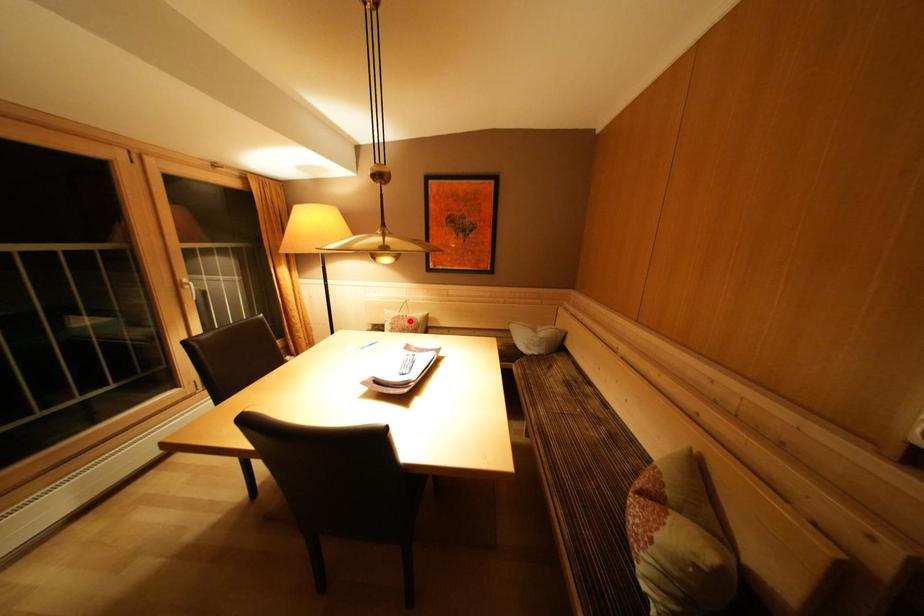
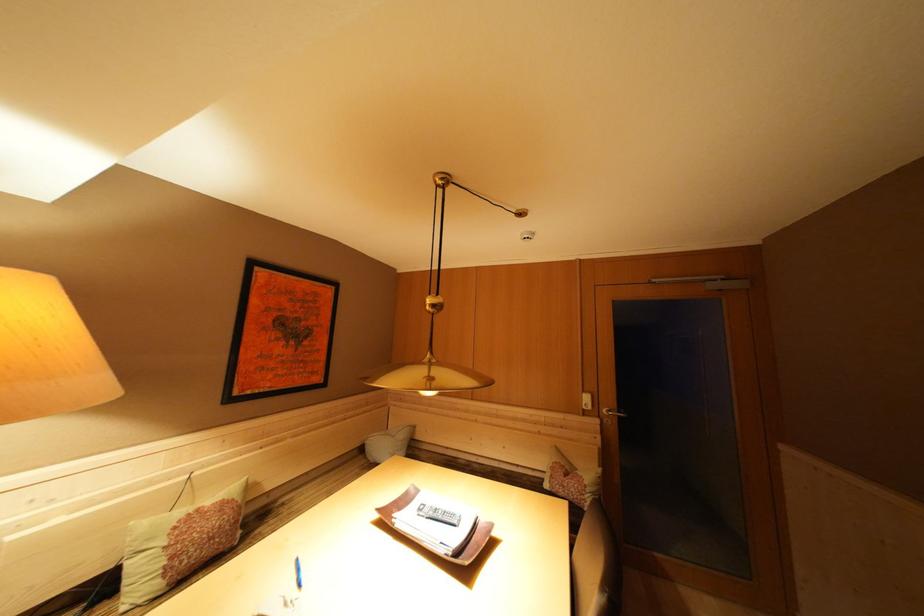
Where in the second image is the point corresponding to the highlighted location from the first image?

(204, 515)